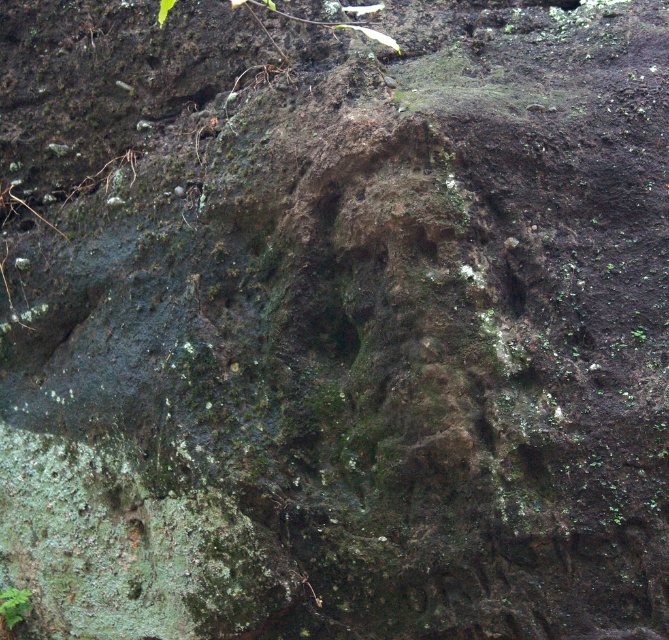
Is green mossy plant at lower left wider than green mossy plant at center?

Yes.

Does point (21, 612) lie behind point (638, 333)?

Yes.

Which is behind, point (1, 604) or point (634, 333)?

Positioned behind is point (1, 604).

Image resolution: width=669 pixels, height=640 pixels. Identify the location of green mossy plant at lower left. (13, 605).